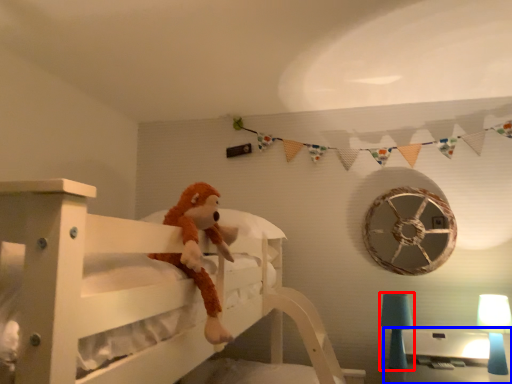
Question: Which object is further to the camera taking this photo, table lamp (highlighted by a red box) or table (highlighted by a blue box)?

Choices:
 (A) table lamp
 (B) table

Answer: (B)